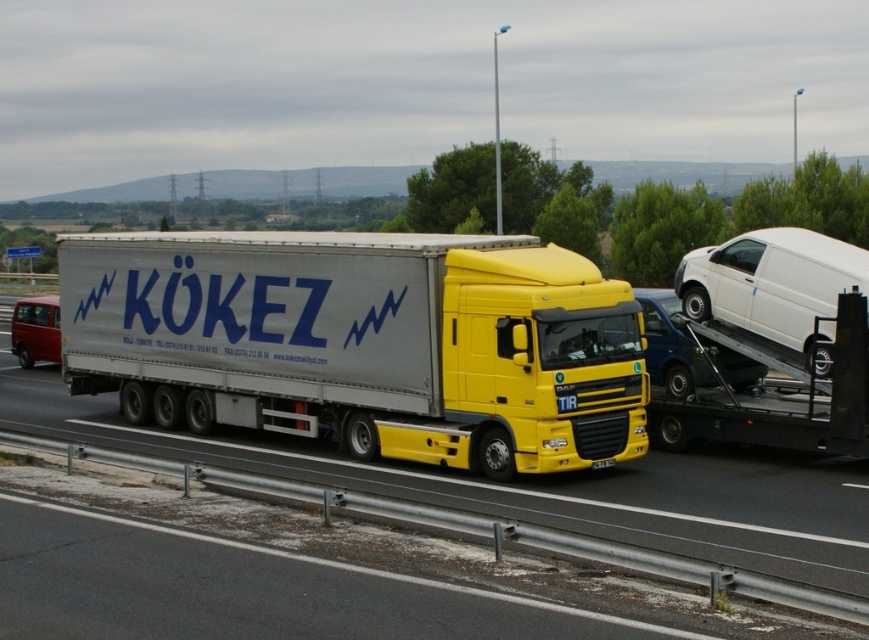
You are a driver who needs to pass the metallic silver tow truck at right and the white matte van at right on the highway. Given that the highway has a single lane in your direction, can you safely overtake both vehicles at the same time?

The metallic silver tow truck at right has a smaller size compared to white matte van at right, so overtaking both at the same time might be possible if there is enough space between them. However, since the highway has a single lane in your direction, overtaking would require finding a suitable passing zone where there is sufficient visibility and space to safely maneuver around both vehicles without oncoming traffic.

You are a truck driver planning to pass another vehicle on this highway. You notice a silver metallic trailer at center and a white glossy van at right. Which vehicle should you avoid overtaking if you want to choose the narrower one for safer passing?

You should avoid overtaking the white glossy van at right because the silver metallic trailer at center is wider than the white glossy van at right, making the van the narrower option for safer passing.